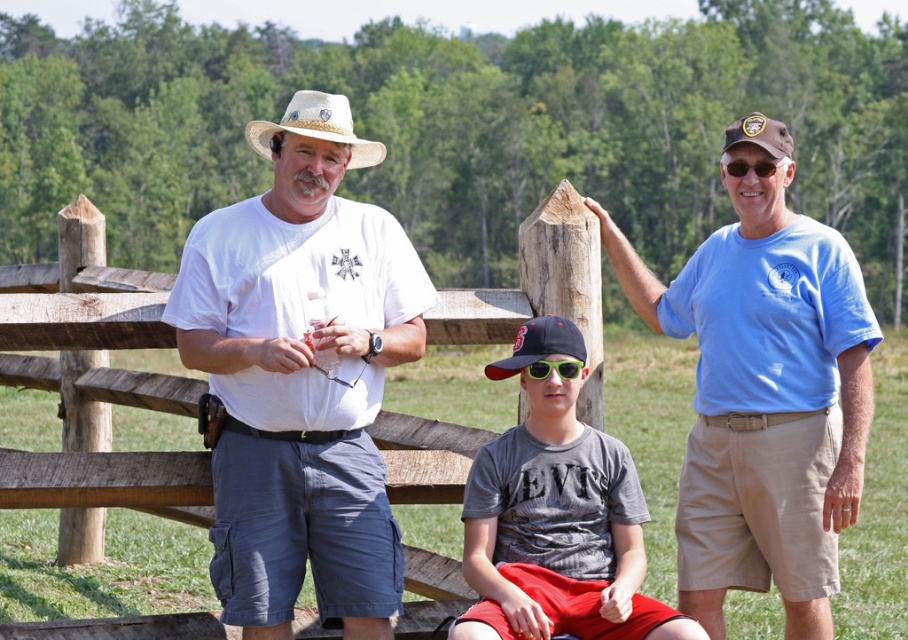
In the scene shown: You are planning to take a photo of the two central figures in the scene. The camera you are using has a limited focus area. Which object between the white cotton shirt at center and the natural straw cowboy hat at center should you focus on first if you want to ensure the larger object is in focus?

Answer: The natural straw cowboy hat at center is larger, so you should focus on it first to ensure it is in focus.